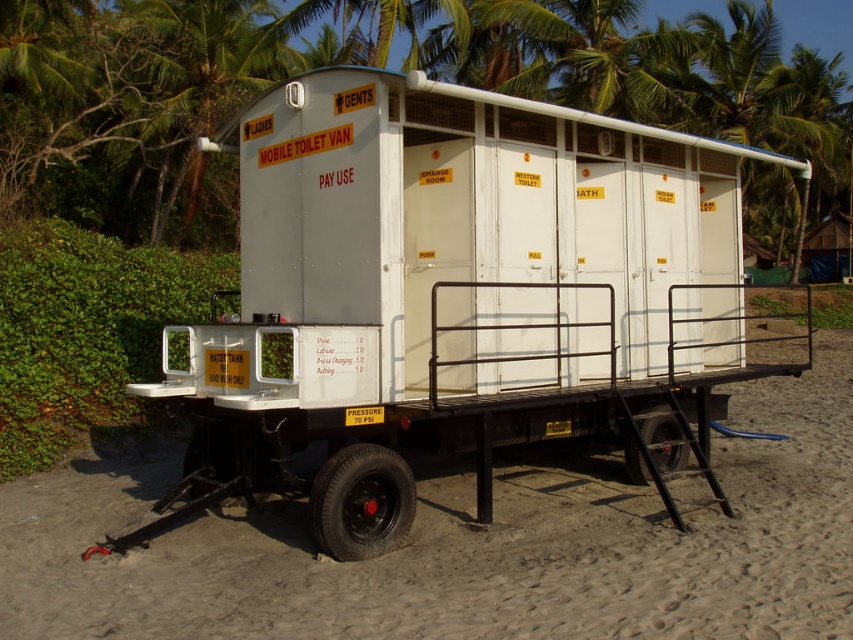
You are a delivery driver approaching the white matte mobile toilet van at center and the white sand at lower center. Your truck is 3 meters wide. Can you safely pass between them without hitting either?

The white matte mobile toilet van at center has a lesser width compared to white sand at lower center. Since the truck is 3 meters wide, it depends on the actual widths of the van and the sand area. However, the description only states the van is narrower than the sand, not their exact measurements. Without specific dimensions, it is impossible to confirm if the truck can safely pass.

You are a tourist standing at the beach and see the white matte mobile toilet van at center and the white sand at lower center. Which object is closer to you?

The white matte mobile toilet van at center is closer to you than the white sand at lower center because the white sand at lower center is behind the white matte mobile toilet van at center.

You are standing at the center of the sandy terrain. The white matte mobile toilet van at center is located at point 0.464, 0.536. If you face north, will the van be to your left or right?

The van is at point (456, 296), so if you face north, the van would be to your right.